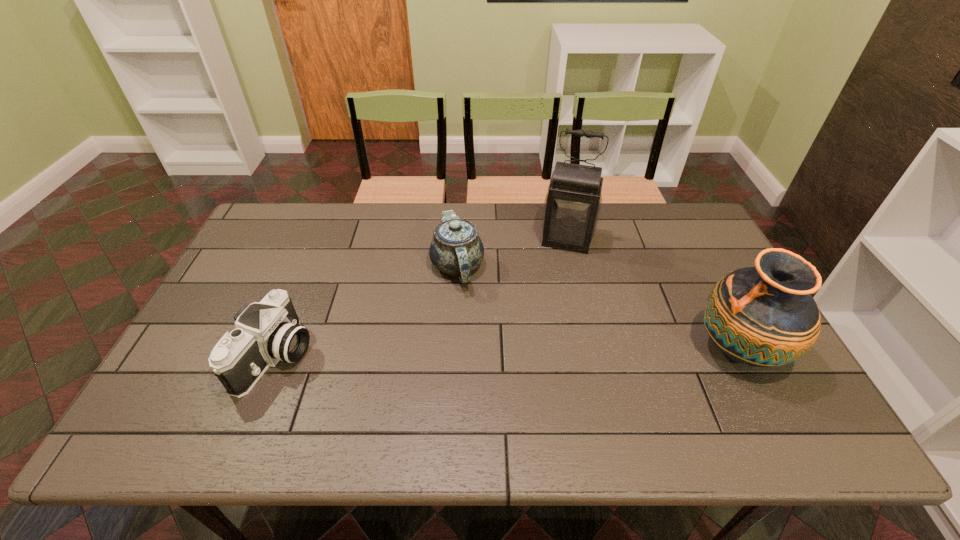
Find the location of `vacant region that satisfies the following two spatial constraints: 1. on the back side of the chinaware; 2. on the left side of the leftmost object`. vacant region that satisfies the following two spatial constraints: 1. on the back side of the chinaware; 2. on the left side of the leftmost object is located at coordinates (313, 266).